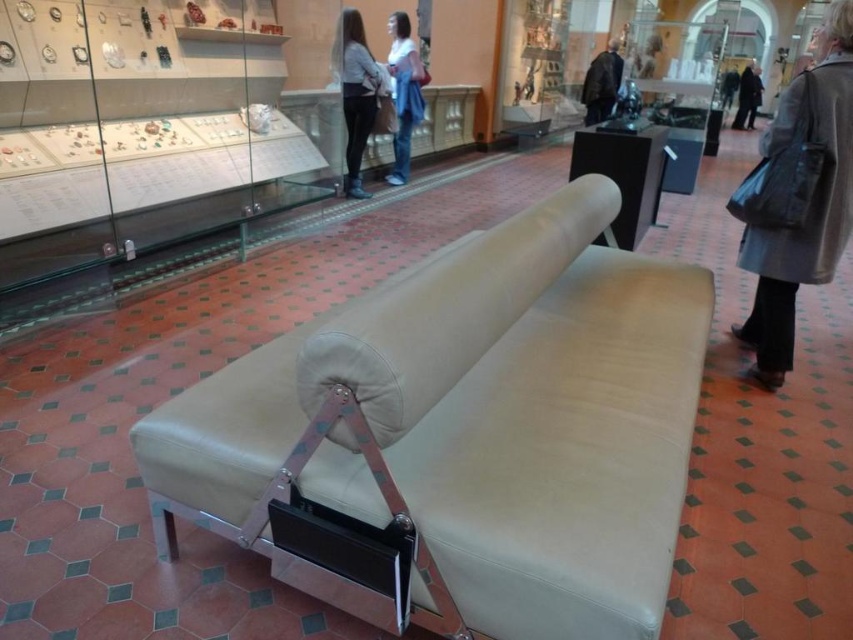
Does point (810, 120) come behind point (395, 99)?

No, (810, 120) is in front of (395, 99).

Which is behind, point (756, 301) or point (387, 179)?

The point (387, 179) is more distant.

At what (x,y) coordinates should I click in order to perform the action: click on gray wool coat at right. Please return your answer as a coordinate pair (x, y). Looking at the image, I should click on (798, 196).

Is beige leather couch at center below matte black speaker at upper center?

Indeed, beige leather couch at center is positioned under matte black speaker at upper center.

Does point (421, 499) lie in front of point (621, 225)?

Yes, point (421, 499) is in front of point (621, 225).

What are the coordinates of `beige leather couch at center` in the screenshot? It's located at (462, 435).

Where is `beige leather couch at center`? This screenshot has height=640, width=853. beige leather couch at center is located at coordinates (462, 435).

Who is positioned more to the left, matte black speaker at upper center or light gray sweater at center?

Positioned to the left is light gray sweater at center.

Find the location of a particular element. The image size is (853, 640). matte black speaker at upper center is located at coordinates (624, 170).

Between point (579, 150) and point (370, 109), which one is positioned behind?

The point (370, 109) is more distant.

This screenshot has height=640, width=853. Identify the location of matte black speaker at upper center. (624, 170).